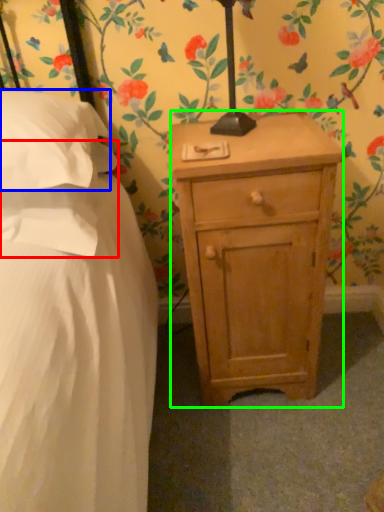
Question: Considering the real-world distances, which object is farthest from pillow (highlighted by a red box)? pillow (highlighted by a blue box) or nightstand (highlighted by a green box)?

Choices:
 (A) pillow
 (B) nightstand

Answer: (B)